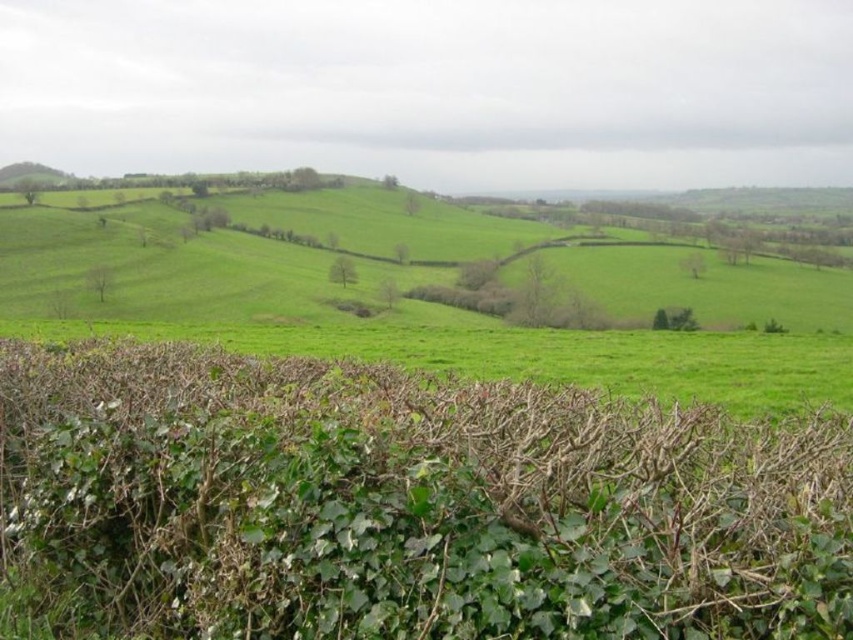
Question: Which object appears farthest from the camera in this image?

Choices:
 (A) green grassy hillside at left
 (B) green grassy field at lower left

Answer: (A)

Question: Does green leafy hedge at lower center have a larger size compared to green grassy field at lower left?

Choices:
 (A) no
 (B) yes

Answer: (A)

Question: Which object is the closest to the green grassy field at lower left?

Choices:
 (A) green grassy hillside at left
 (B) green leafy hedge at lower center

Answer: (B)

Question: Can you confirm if green grassy field at lower left is positioned to the right of green grassy hillside at left?

Choices:
 (A) no
 (B) yes

Answer: (B)

Question: Does green grassy field at lower left have a smaller size compared to green grassy hillside at left?

Choices:
 (A) no
 (B) yes

Answer: (A)

Question: Which of the following is the farthest from the observer?

Choices:
 (A) (27, 285)
 (B) (16, 173)
 (C) (233, 508)

Answer: (B)